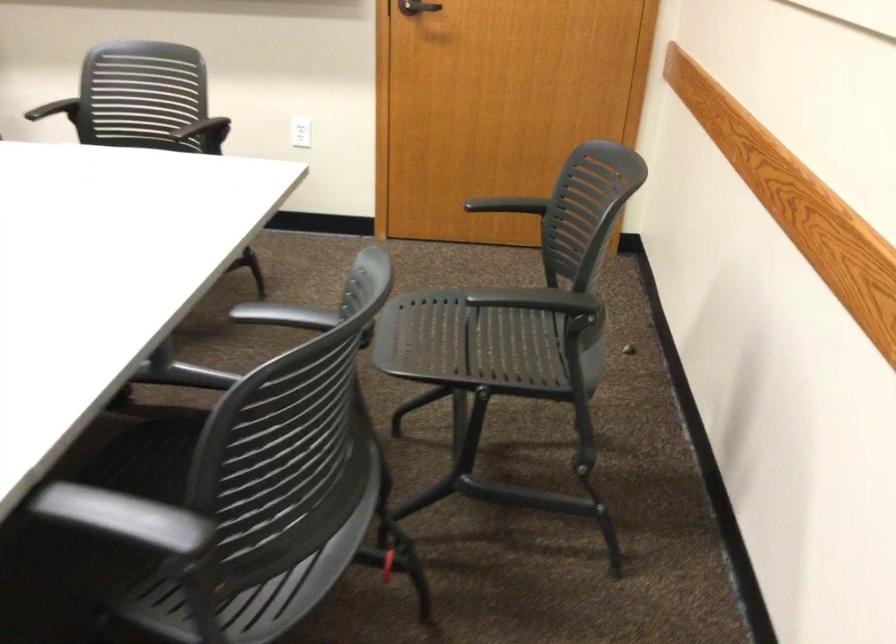
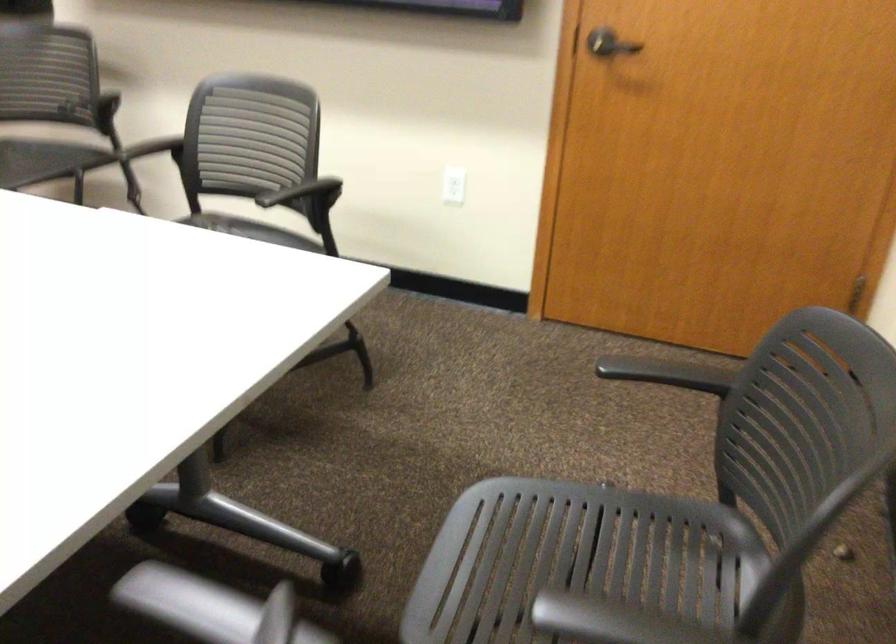
Question: In a continuous first-person perspective shot, in which direction is the camera moving?

Choices:
 (A) Left
 (B) Right
 (C) Forward
 (D) Backward

Answer: (C)